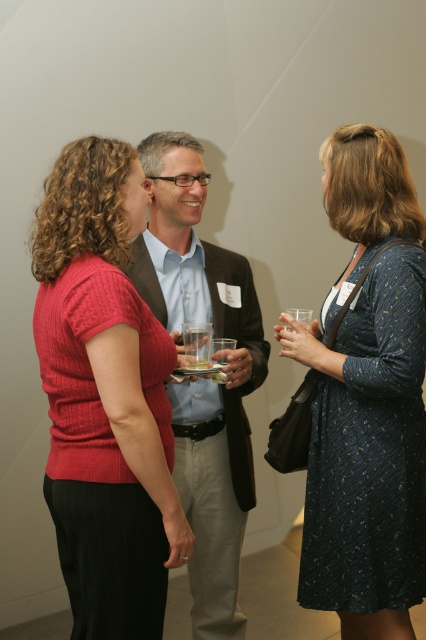
Question: Can you confirm if matte red sweater at left is positioned to the right of blue textured dress at right?

Choices:
 (A) yes
 (B) no

Answer: (B)

Question: Considering the real-world distances, which object is farthest from the clear glass at center?

Choices:
 (A) matte black suit at center
 (B) blue textured dress at right
 (C) matte red sweater at left

Answer: (B)

Question: Can you confirm if matte red sweater at left is thinner than matte black suit at center?

Choices:
 (A) no
 (B) yes

Answer: (B)

Question: Which object is positioned closest to the matte black suit at center?

Choices:
 (A) clear glass at center
 (B) matte red sweater at left

Answer: (A)

Question: Based on their relative distances, which object is farther from the matte black suit at center?

Choices:
 (A) clear glass at center
 (B) matte red sweater at left
 (C) blue textured dress at right

Answer: (B)

Question: Is blue textured dress at right wider than clear glass at center?

Choices:
 (A) yes
 (B) no

Answer: (A)